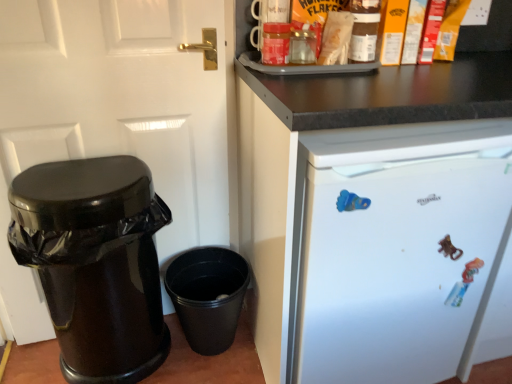
Question: Does black plastic bucket at lower center have a lesser width compared to white matte refrigerator at upper right?

Choices:
 (A) no
 (B) yes

Answer: (B)

Question: Considering the relative positions of black plastic bucket at lower center and white matte refrigerator at upper right in the image provided, is black plastic bucket at lower center in front of white matte refrigerator at upper right?

Choices:
 (A) no
 (B) yes

Answer: (A)

Question: Can you confirm if black plastic bucket at lower center is bigger than white matte refrigerator at upper right?

Choices:
 (A) yes
 (B) no

Answer: (B)

Question: Is black plastic bucket at lower center at the left side of white matte refrigerator at upper right?

Choices:
 (A) no
 (B) yes

Answer: (B)

Question: Are black plastic bucket at lower center and white matte refrigerator at upper right making contact?

Choices:
 (A) no
 (B) yes

Answer: (A)

Question: Is white matte refrigerator at upper right located within black plastic bucket at lower center?

Choices:
 (A) yes
 (B) no

Answer: (B)

Question: Are matte brown jar at upper center and white glossy door at left far apart?

Choices:
 (A) yes
 (B) no

Answer: (B)

Question: From a real-world perspective, is matte brown jar at upper center on top of white glossy door at left?

Choices:
 (A) no
 (B) yes

Answer: (B)

Question: Does matte brown jar at upper center have a lesser height compared to white glossy door at left?

Choices:
 (A) yes
 (B) no

Answer: (A)

Question: Is matte brown jar at upper center bigger than white glossy door at left?

Choices:
 (A) no
 (B) yes

Answer: (A)

Question: From the image's perspective, would you say matte brown jar at upper center is shown under white glossy door at left?

Choices:
 (A) yes
 (B) no

Answer: (B)

Question: Considering the relative positions of matte brown jar at upper center and white glossy door at left in the image provided, is matte brown jar at upper center to the left of white glossy door at left from the viewer's perspective?

Choices:
 (A) no
 (B) yes

Answer: (A)

Question: From a real-world perspective, is white matte refrigerator at upper right on top of white glossy door at left?

Choices:
 (A) yes
 (B) no

Answer: (B)